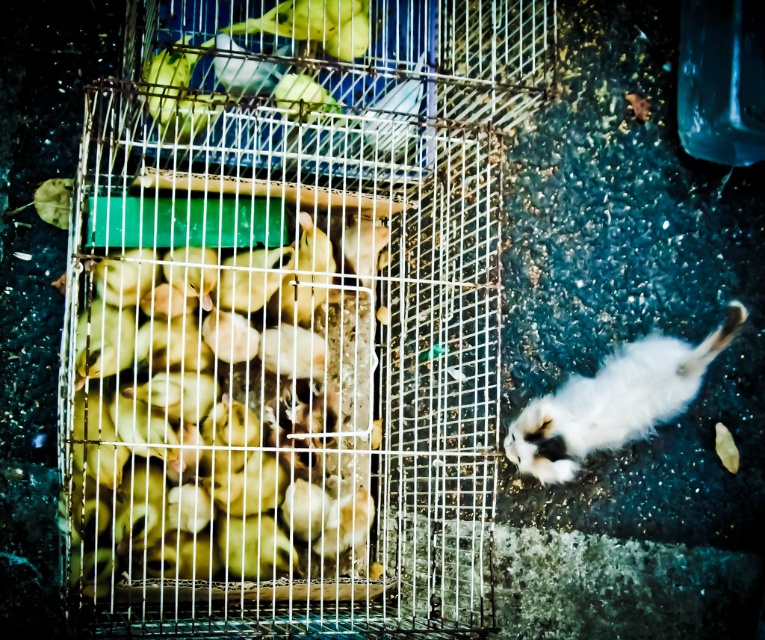
Can you confirm if metal wire bird cage at left is bigger than yellow matte chicks at center?

Yes, metal wire bird cage at left is bigger than yellow matte chicks at center.

Does point (243, 96) come behind point (223, 372)?

No, (243, 96) is in front of (223, 372).

Where is `metal wire bird cage at left`? Image resolution: width=765 pixels, height=640 pixels. metal wire bird cage at left is located at coordinates (291, 314).

Does yellow matte chicks at center have a lesser width compared to white fluffy cat at lower right?

Yes, yellow matte chicks at center is thinner than white fluffy cat at lower right.

Is yellow matte chicks at center taller than white fluffy cat at lower right?

Indeed, yellow matte chicks at center has a greater height compared to white fluffy cat at lower right.

Between point (290, 481) and point (687, 349), which one is positioned in front?

Positioned in front is point (290, 481).

In order to click on yellow matte chicks at center in this screenshot , I will do `click(216, 417)`.

Does metal wire bird cage at left appear under white fluffy cat at lower right?

Actually, metal wire bird cage at left is above white fluffy cat at lower right.

Between metal wire bird cage at left and white fluffy cat at lower right, which one has more height?

metal wire bird cage at left is taller.

Describe the element at coordinates (291, 314) in the screenshot. I see `metal wire bird cage at left` at that location.

Identify the location of metal wire bird cage at left. (291, 314).